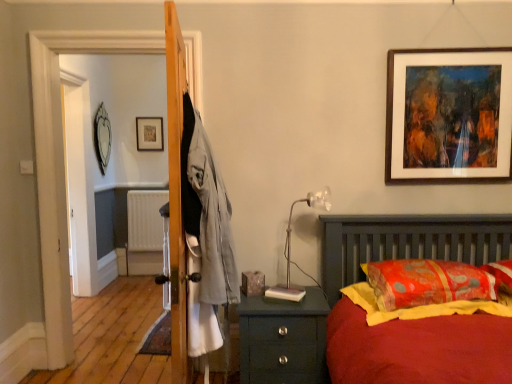
Find the location of a particular element. wooden picture frame at upper center, which is the second picture frame in left-to-right order is located at coordinates (149, 133).

Where is `silver metallic mirror at upper left, arranged as the first picture frame when viewed from the left`? The image size is (512, 384). silver metallic mirror at upper left, arranged as the first picture frame when viewed from the left is located at coordinates (102, 137).

I want to click on wooden screen door at left, so click(x=62, y=150).

Where is `translucent plastic table lamp at right`? Image resolution: width=512 pixels, height=384 pixels. translucent plastic table lamp at right is located at coordinates (290, 230).

Identify the location of brown wooden picture frame at upper right, the 3th picture frame when ordered from left to right. Image resolution: width=512 pixels, height=384 pixels. (449, 115).

Locate an element on the screen. The width and height of the screenshot is (512, 384). wooden picture frame at upper center, marked as the 2th picture frame in a right-to-left arrangement is located at coordinates (149, 133).

Which is more to the right, wooden picture frame at upper center, which is the 3th picture frame in front-to-back order, or white plastic radiator at center?

wooden picture frame at upper center, which is the 3th picture frame in front-to-back order, is more to the right.

Can you confirm if wooden picture frame at upper center, which is the second picture frame in left-to-right order, is thinner than white plastic radiator at center?

Correct, the width of wooden picture frame at upper center, which is the second picture frame in left-to-right order, is less than that of white plastic radiator at center.

Is wooden picture frame at upper center, which is the 3th picture frame in front-to-back order, positioned far away from white plastic radiator at center?

wooden picture frame at upper center, which is the 3th picture frame in front-to-back order, is actually quite close to white plastic radiator at center.

This screenshot has width=512, height=384. Find the location of `table lamp located underneath the brown wooden picture frame at upper right, the first picture frame in the right-to-left sequence (from a real-world perspective)`. table lamp located underneath the brown wooden picture frame at upper right, the first picture frame in the right-to-left sequence (from a real-world perspective) is located at coordinates (290, 230).

Between point (289, 215) and point (502, 160), which one is positioned behind?

Positioned behind is point (289, 215).

Considering the sizes of objects translucent plastic table lamp at right and brown wooden picture frame at upper right, which appears as the third picture frame when viewed from the back, in the image provided, who is smaller, translucent plastic table lamp at right or brown wooden picture frame at upper right, which appears as the third picture frame when viewed from the back,?

translucent plastic table lamp at right.

Is brown wooden picture frame at upper right, the 3th picture frame when ordered from left to right, positioned before teal wooden nightstand at lower right?

No, it is behind teal wooden nightstand at lower right.

Could you tell me if brown wooden picture frame at upper right, arranged as the 1th picture frame when viewed from the front, is facing teal wooden nightstand at lower right?

No, brown wooden picture frame at upper right, arranged as the 1th picture frame when viewed from the front, is not oriented towards teal wooden nightstand at lower right.

Between brown wooden picture frame at upper right, the 3th picture frame when ordered from left to right, and teal wooden nightstand at lower right, which one has more height?

brown wooden picture frame at upper right, the 3th picture frame when ordered from left to right.

Is there a large distance between brown wooden picture frame at upper right, the 3th picture frame when ordered from left to right, and teal wooden nightstand at lower right?

Yes, brown wooden picture frame at upper right, the 3th picture frame when ordered from left to right, and teal wooden nightstand at lower right are located far from each other.

In the scene shown: Who is bigger, orange fabric pillow at right or wooden screen door at left?

Bigger between the two is wooden screen door at left.

Which is farther from the camera, (472, 281) or (182, 62)?

Positioned behind is point (472, 281).

Does orange fabric pillow at right turn towards wooden screen door at left?

No, orange fabric pillow at right is not oriented towards wooden screen door at left.

Is wooden screen door at left located within orange fabric pillow at right?

No, orange fabric pillow at right does not contain wooden screen door at left.

The image size is (512, 384). I want to click on screen door that appears above the orange fabric pillow at right (from a real-world perspective), so coord(62,150).

Who is more distant, wooden screen door at left or orange fabric pillow at right?

wooden screen door at left is further away from the camera.

Would you say orange fabric pillow at right is part of wooden screen door at left's contents?

No, orange fabric pillow at right is not surrounded by wooden screen door at left.

Can you confirm if wooden screen door at left is smaller than orange fabric pillow at right?

No.

Considering the relative sizes of brown wooden picture frame at upper right, arranged as the 1th picture frame when viewed from the front, and wooden picture frame at upper center, which is the 3th picture frame in front-to-back order, in the image provided, is brown wooden picture frame at upper right, arranged as the 1th picture frame when viewed from the front, shorter than wooden picture frame at upper center, which is the 3th picture frame in front-to-back order,?

In fact, brown wooden picture frame at upper right, arranged as the 1th picture frame when viewed from the front, may be taller than wooden picture frame at upper center, which is the 3th picture frame in front-to-back order.

Considering the sizes of objects brown wooden picture frame at upper right, arranged as the 1th picture frame when viewed from the front, and wooden picture frame at upper center, which is the 3th picture frame in front-to-back order, in the image provided, who is smaller, brown wooden picture frame at upper right, arranged as the 1th picture frame when viewed from the front, or wooden picture frame at upper center, which is the 3th picture frame in front-to-back order,?

wooden picture frame at upper center, which is the 3th picture frame in front-to-back order, is smaller.

Does brown wooden picture frame at upper right, the 3th picture frame when ordered from left to right, have a greater width compared to wooden picture frame at upper center, the first picture frame viewed from the back?

Indeed, brown wooden picture frame at upper right, the 3th picture frame when ordered from left to right, has a greater width compared to wooden picture frame at upper center, the first picture frame viewed from the back.

Does brown wooden picture frame at upper right, the first picture frame in the right-to-left sequence, come in front of wooden picture frame at upper center, which is the second picture frame in left-to-right order?

Yes, the depth of brown wooden picture frame at upper right, the first picture frame in the right-to-left sequence, is less than that of wooden picture frame at upper center, which is the second picture frame in left-to-right order.

From the image's perspective, between orange fabric pillow at right and translucent plastic table lamp at right, who is located below?

orange fabric pillow at right appears lower in the image.

Which is behind, orange fabric pillow at right or translucent plastic table lamp at right?

translucent plastic table lamp at right.

Is point (409, 295) positioned after point (289, 227)?

No, it is in front of (289, 227).

Does orange fabric pillow at right have a lesser height compared to translucent plastic table lamp at right?

Indeed, orange fabric pillow at right has a lesser height compared to translucent plastic table lamp at right.

The height and width of the screenshot is (384, 512). There is a white plastic radiator at center. What are the coordinates of `the 3rd picture frame above it (from the image's perspective)` in the screenshot? It's located at (149, 133).

You are a GUI agent. You are given a task and a screenshot of the screen. Output one action in this format:
    pyautogui.click(x=<x>, y=<y>)
    Task: Click on the table lamp that is on the left side of brown wooden picture frame at upper right, arranged as the 1th picture frame when viewed from the front
    This screenshot has width=512, height=384.
    Given the screenshot: What is the action you would take?
    pyautogui.click(x=290, y=230)

Estimate the real-world distances between objects in this image. Which object is further from translucent plastic table lamp at right, wooden picture frame at upper center, marked as the 2th picture frame in a right-to-left arrangement, or white plastic radiator at center?

The object further to translucent plastic table lamp at right is wooden picture frame at upper center, marked as the 2th picture frame in a right-to-left arrangement.

Based on their spatial positions, is wooden picture frame at upper center, marked as the 2th picture frame in a right-to-left arrangement, or white plastic radiator at center closer to wooden screen door at left?

Among the two, white plastic radiator at center is located nearer to wooden screen door at left.

Looking at the image, which one is located further to wooden screen door at left, teal wooden nightstand at lower right or orange fabric pillow at right?

Based on the image, orange fabric pillow at right appears to be further to wooden screen door at left.

Consider the image. Considering their positions, is white plastic radiator at center positioned further to brown wooden picture frame at upper right, the 3th picture frame when ordered from left to right, than teal wooden nightstand at lower right?

white plastic radiator at center.

Which object lies further to the anchor point wooden screen door at left, brown wooden picture frame at upper right, arranged as the 1th picture frame when viewed from the front, or orange fabric pillow at right?

The object further to wooden screen door at left is orange fabric pillow at right.

Looking at the image, which one is located further to silver metallic mirror at upper left, the 2th picture frame viewed from the back, wooden picture frame at upper center, the first picture frame viewed from the back, or white plastic radiator at center?

white plastic radiator at center is further to silver metallic mirror at upper left, the 2th picture frame viewed from the back.

Considering their positions, is brown wooden picture frame at upper right, arranged as the 1th picture frame when viewed from the front, positioned further to silver metallic mirror at upper left, the third picture frame when ordered from right to left, than orange fabric pillow at right?

orange fabric pillow at right is further to silver metallic mirror at upper left, the third picture frame when ordered from right to left.

Considering their positions, is translucent plastic table lamp at right positioned further to brown wooden picture frame at upper right, arranged as the 1th picture frame when viewed from the front, than white plastic radiator at center?

white plastic radiator at center is positioned further to the anchor brown wooden picture frame at upper right, arranged as the 1th picture frame when viewed from the front.

Find the location of a particular element. picture frame between white plastic radiator at center and brown wooden picture frame at upper right, the first picture frame in the right-to-left sequence, in the horizontal direction is located at coordinates (149, 133).

You are a GUI agent. You are given a task and a screenshot of the screen. Output one action in this format:
    pyautogui.click(x=<x>, y=<y>)
    Task: Click on the screen door between teal wooden nightstand at lower right and wooden picture frame at upper center, which is the second picture frame in left-to-right order, along the z-axis
    The width and height of the screenshot is (512, 384).
    Given the screenshot: What is the action you would take?
    pyautogui.click(x=62, y=150)

Where is `nightstand situated between wooden screen door at left and translucent plastic table lamp at right from left to right`? nightstand situated between wooden screen door at left and translucent plastic table lamp at right from left to right is located at coordinates (283, 339).

You are a GUI agent. You are given a task and a screenshot of the screen. Output one action in this format:
    pyautogui.click(x=<x>, y=<y>)
    Task: Click on the radiator located between translucent plastic table lamp at right and wooden picture frame at upper center, which is the second picture frame in left-to-right order, in the depth direction
    This screenshot has width=512, height=384.
    Given the screenshot: What is the action you would take?
    pyautogui.click(x=146, y=219)